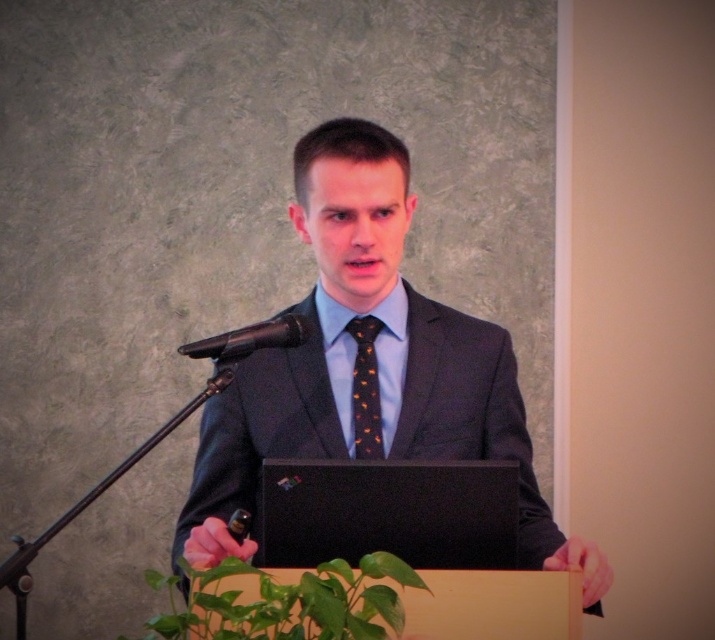
Can you confirm if black dotted tie at center is shorter than black metallic microphone at center?

In fact, black dotted tie at center may be taller than black metallic microphone at center.

Is point (375, 369) in front of point (225, 339)?

No, (375, 369) is further to viewer.

You are a GUI agent. You are given a task and a screenshot of the screen. Output one action in this format:
    pyautogui.click(x=<x>, y=<y>)
    Task: Click on the black dotted tie at center
    
    Given the screenshot: What is the action you would take?
    pyautogui.click(x=365, y=388)

The width and height of the screenshot is (715, 640). What do you see at coordinates (378, 365) in the screenshot?
I see `matte black suit at center` at bounding box center [378, 365].

Does point (261, 442) come behind point (235, 348)?

That is True.

What do you see at coordinates (378, 365) in the screenshot?
I see `matte black suit at center` at bounding box center [378, 365].

This screenshot has width=715, height=640. Identify the location of matte black suit at center. (378, 365).

Looking at this image, who is shorter, matte black suit at center or black dotted tie at center?

With less height is black dotted tie at center.

This screenshot has width=715, height=640. I want to click on matte black suit at center, so tap(378, 365).